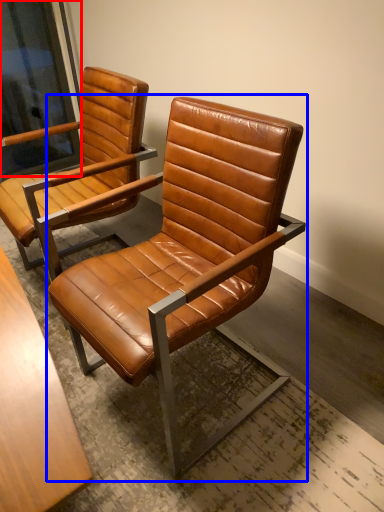
Question: Which object is closer to the camera taking this photo, window screen (highlighted by a red box) or chair (highlighted by a blue box)?

Choices:
 (A) window screen
 (B) chair

Answer: (B)